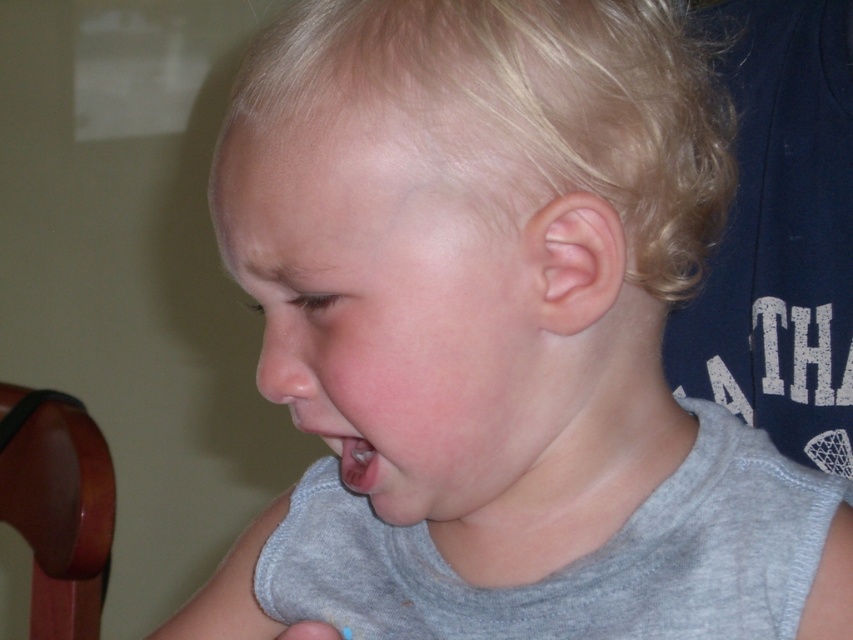
Question: Considering the relative positions of brown wood chair at lower left and pink flesh at center in the image provided, where is brown wood chair at lower left located with respect to pink flesh at center?

Choices:
 (A) above
 (B) below

Answer: (B)

Question: Among these points, which one is farthest from the camera?

Choices:
 (A) (7, 410)
 (B) (361, 490)

Answer: (A)

Question: Is brown wood chair at lower left above pink flesh at center?

Choices:
 (A) no
 (B) yes

Answer: (A)

Question: Does brown wood chair at lower left have a greater width compared to pink flesh at center?

Choices:
 (A) yes
 (B) no

Answer: (A)